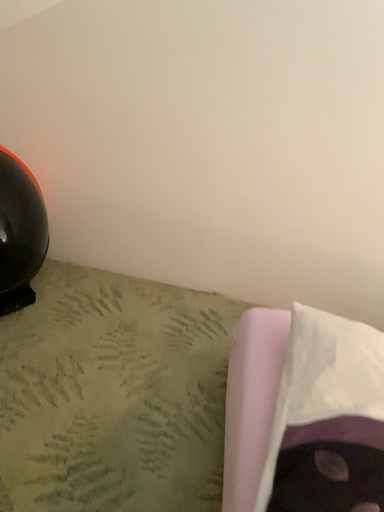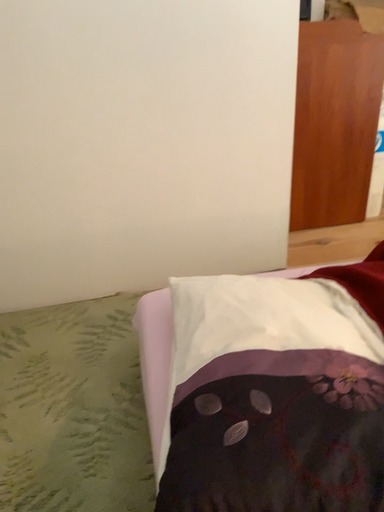
Question: Which way did the camera rotate in the video?

Choices:
 (A) rotated left
 (B) rotated right

Answer: (B)